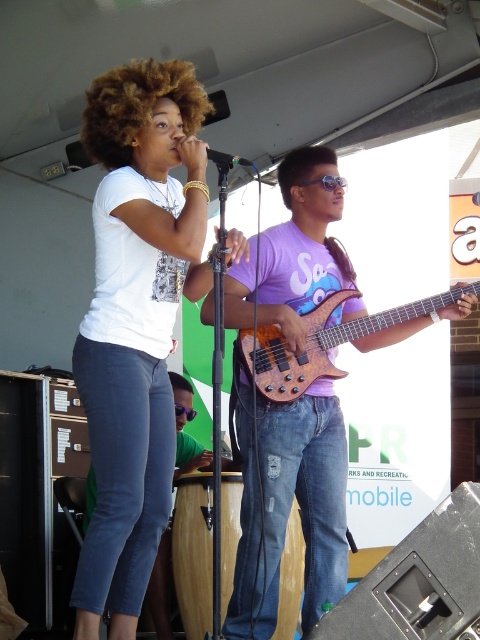
Question: Which point is closer to the camera taking this photo?

Choices:
 (A) (325, 272)
 (B) (348, 292)
 (C) (228, 168)
 (D) (111, 316)

Answer: (C)

Question: Observing the image, what is the correct spatial positioning of matte purple shirt at center in reference to orange wood bass at center?

Choices:
 (A) right
 (B) left

Answer: (B)

Question: Which of these objects is positioned closest to the metallic silver microphone at center?

Choices:
 (A) matte purple shirt at center
 (B) orange wood bass at center

Answer: (B)

Question: Is white matte t-shirt at upper left positioned behind orange wood bass at center?

Choices:
 (A) yes
 (B) no

Answer: (B)

Question: Which object appears farthest from the camera in this image?

Choices:
 (A) white matte t-shirt at upper left
 (B) matte purple shirt at center

Answer: (B)

Question: Is matte purple shirt at center positioned at the back of metallic silver microphone at center?

Choices:
 (A) yes
 (B) no

Answer: (A)